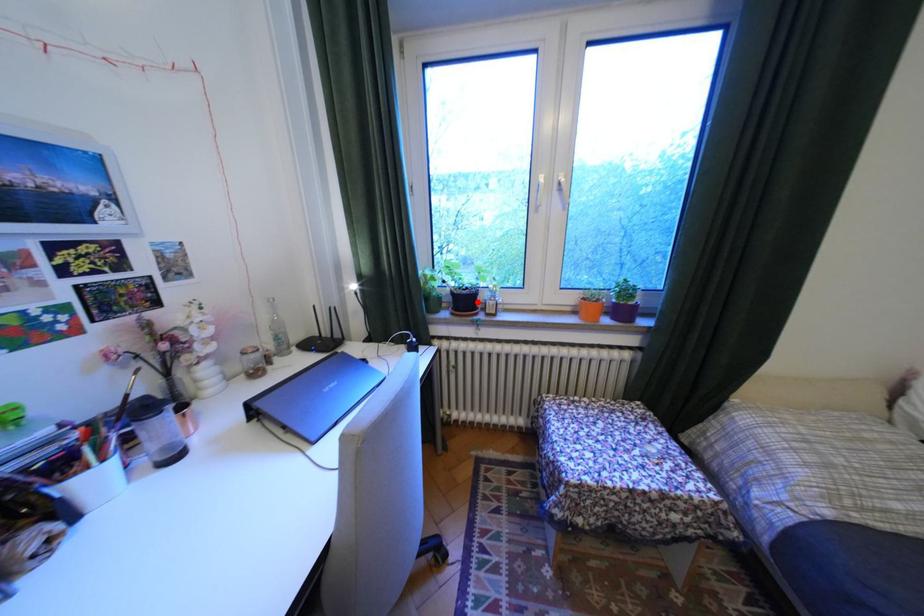
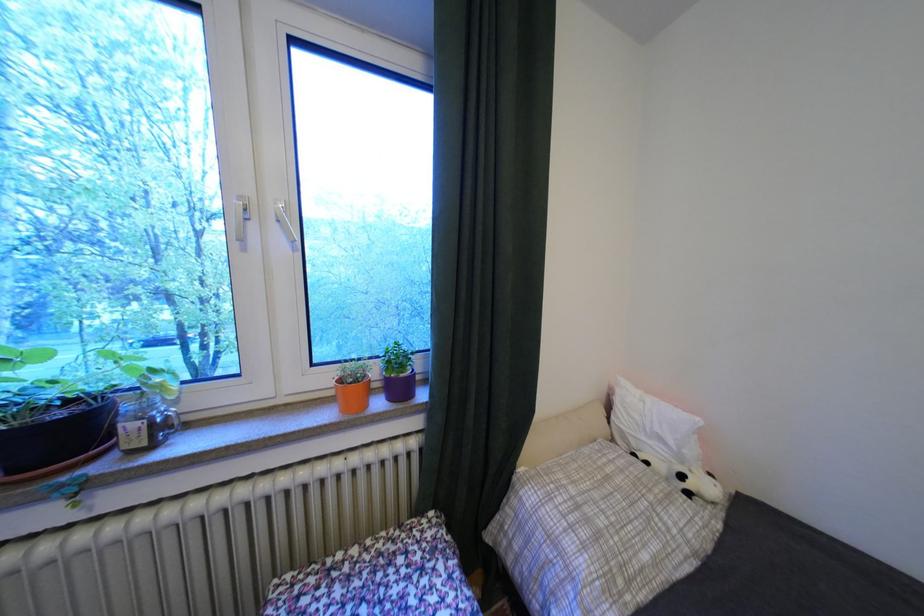
Where in the second image is the point corresponding to the highlighted location from the first image?

(75, 436)